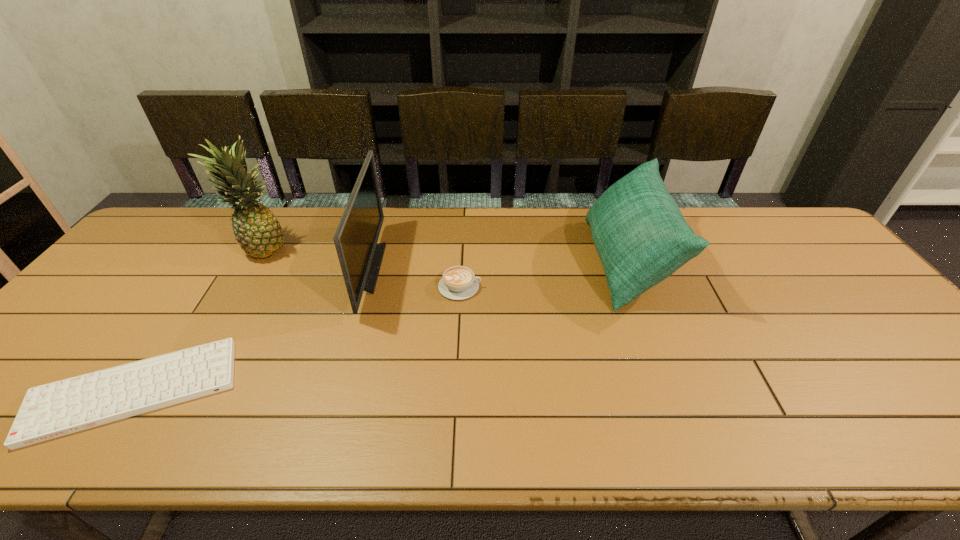
Find the location of a particular element. This screenshot has width=960, height=540. free space located on the side of the cappuccino with the handle is located at coordinates (611, 287).

Locate an element on the screen. This screenshot has width=960, height=540. pineapple that is at the far edge is located at coordinates (256, 229).

Locate an element on the screen. monitor that is at the far edge is located at coordinates (356, 237).

Where is `cushion situated at the far edge`? Image resolution: width=960 pixels, height=540 pixels. cushion situated at the far edge is located at coordinates (641, 237).

Find the location of a particular element. This screenshot has width=960, height=540. free space at the far edge of the desktop is located at coordinates (742, 229).

Image resolution: width=960 pixels, height=540 pixels. In the image, there is a desktop. In order to click on vacant area at the near edge in this screenshot , I will do `click(713, 426)`.

Image resolution: width=960 pixels, height=540 pixels. I want to click on free space at the left edge, so click(x=35, y=365).

Image resolution: width=960 pixels, height=540 pixels. Find the location of `vacant position at the right edge of the desktop`. vacant position at the right edge of the desktop is located at coordinates (910, 394).

Locate an element on the screen. free space at the near left corner is located at coordinates (7, 435).

Locate an element on the screen. vacant space at the far right corner is located at coordinates (782, 218).